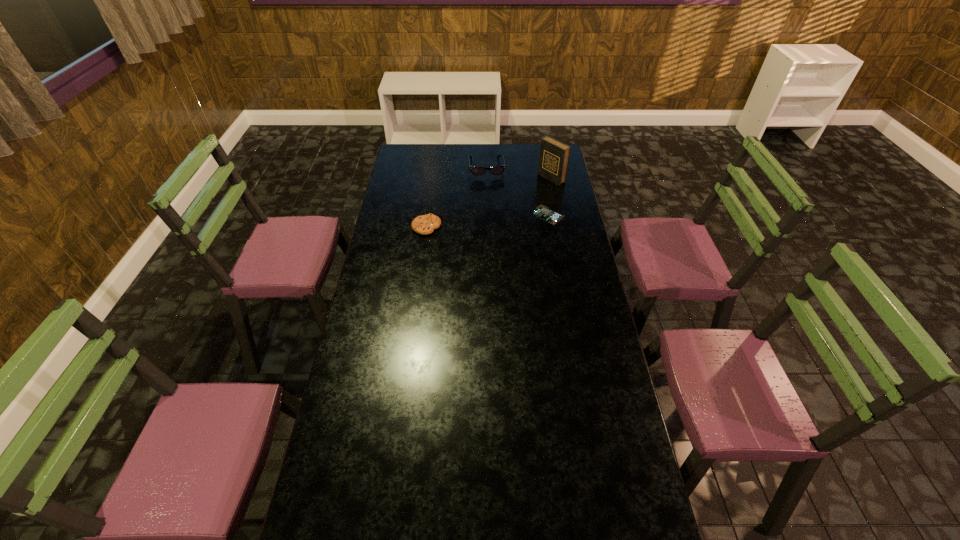
In the image, there is a desktop. Where is `vacant space at the left edge`? Image resolution: width=960 pixels, height=540 pixels. vacant space at the left edge is located at coordinates (340, 466).

At what (x,y) coordinates should I click in order to perform the action: click on free region at the right edge. Please return your answer as a coordinate pair (x, y). Looking at the image, I should click on (567, 224).

Locate an element on the screen. vacant space at the far left corner of the desktop is located at coordinates (420, 154).

Identify the location of free space at the near left corner of the desktop. (336, 530).

Where is `vacant area at the far right corner`? vacant area at the far right corner is located at coordinates (535, 147).

Identify the location of free location at the near right corner of the desktop. (591, 500).

Find the location of a particular element. Image resolution: width=960 pixels, height=540 pixels. free space between the leftmost object and the spectacles is located at coordinates (456, 198).

Image resolution: width=960 pixels, height=540 pixels. I want to click on vacant area between the third tallest object and the identity card, so click(x=488, y=221).

Image resolution: width=960 pixels, height=540 pixels. Identify the location of vacant region between the shortest object and the leftmost object. (488, 221).

At what (x,y) coordinates should I click in order to perform the action: click on free space between the third tallest object and the diary. Please return your answer as a coordinate pair (x, y). Looking at the image, I should click on (489, 202).